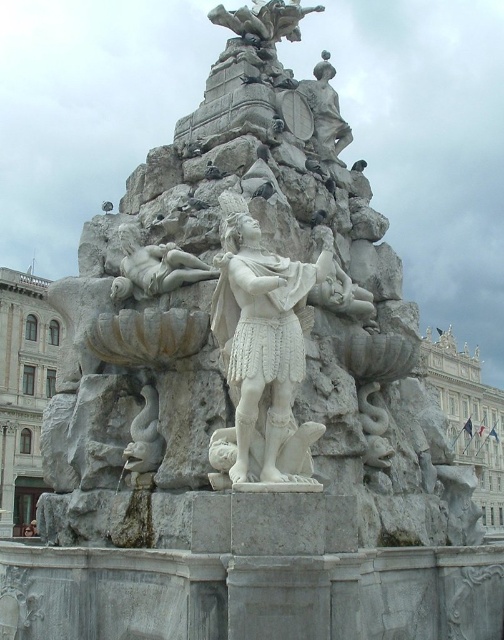
Question: Which of the following is the closest to the observer?

Choices:
 (A) (324, 144)
 (B) (130, 289)

Answer: (B)

Question: Is white marble reclining figure at center wider than white marble statue at upper center?

Choices:
 (A) no
 (B) yes

Answer: (B)

Question: Which point is farther to the camera?

Choices:
 (A) white marble statue at upper center
 (B) white marble statue at center
 (C) white marble reclining figure at center

Answer: (A)

Question: Is white marble reclining figure at center thinner than white marble statue at upper center?

Choices:
 (A) no
 (B) yes

Answer: (A)

Question: Which point is closer to the camera taking this photo?

Choices:
 (A) (327, 131)
 (B) (209, 266)

Answer: (B)

Question: Can you confirm if white marble statue at center is positioned above white marble statue at upper center?

Choices:
 (A) no
 (B) yes

Answer: (A)